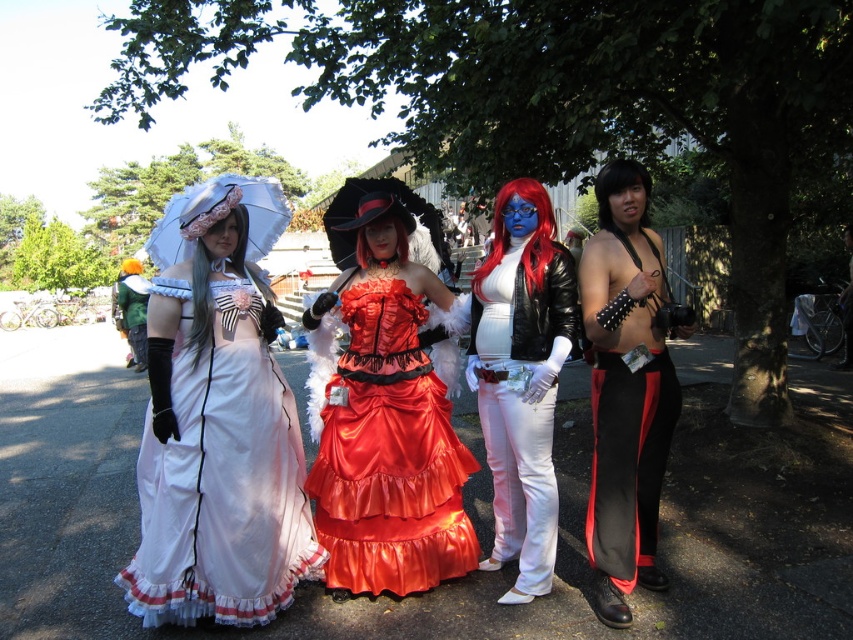
Between point (619, 307) and point (509, 548), which one is positioned behind?

The point (509, 548) is behind.

This screenshot has height=640, width=853. Identify the location of shiny black leather pants at right. (627, 387).

Based on the photo, is matte white dress at left in front of white matte pants at center?

Yes.

Does matte white dress at left appear on the right side of white matte pants at center?

In fact, matte white dress at left is to the left of white matte pants at center.

Which is in front, point (173, 608) or point (520, 397)?

Point (173, 608)

Identify the location of matte white dress at left. (218, 420).

What do you see at coordinates (386, 404) in the screenshot? The width and height of the screenshot is (853, 640). I see `shiny satin dress at center` at bounding box center [386, 404].

At what (x,y) coordinates should I click in order to perform the action: click on shiny satin dress at center. Please return your answer as a coordinate pair (x, y). This screenshot has width=853, height=640. Looking at the image, I should click on (386, 404).